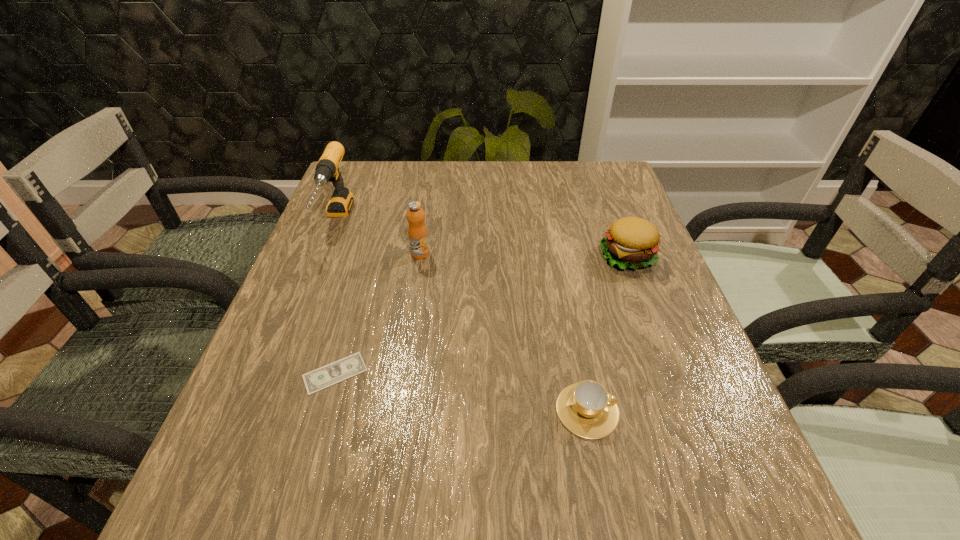
Where is `empty space between the shortest object and the drill`? Image resolution: width=960 pixels, height=540 pixels. empty space between the shortest object and the drill is located at coordinates (335, 297).

Find the location of a particular element. The image size is (960, 540). vacant region between the second tallest object and the shortest object is located at coordinates (377, 313).

At what (x,y) coordinates should I click in order to perform the action: click on free point between the third object from right to left and the rightmost object. Please return your answer as a coordinate pair (x, y). Looking at the image, I should click on (524, 255).

Identify the location of free space between the third object from left to right and the fourth tallest object. This screenshot has width=960, height=540. (504, 332).

Where is `object that is the fourth nearest to the third tallest object`? object that is the fourth nearest to the third tallest object is located at coordinates (327, 170).

Locate an element on the screen. The height and width of the screenshot is (540, 960). object that can be found as the second closest to the orange juice is located at coordinates (338, 371).

Image resolution: width=960 pixels, height=540 pixels. What are the coordinates of `free location that satisfies the following two spatial constraints: 1. on the front label of the second tallest object; 2. on the left side of the hamburger` in the screenshot? It's located at (420, 256).

You are a GUI agent. You are given a task and a screenshot of the screen. Output one action in this format:
    pyautogui.click(x=<x>, y=<y>)
    Task: Click on the vacant space that satisfies the following two spatial constraints: 1. on the front label of the hamburger; 2. on the left side of the third object from left to right
    
    Given the screenshot: What is the action you would take?
    [420, 256]

This screenshot has height=540, width=960. In order to click on vacant point that satisfies the following two spatial constraints: 1. on the back side of the shortest object; 2. on the left side of the third shortest object in this screenshot , I will do `click(369, 256)`.